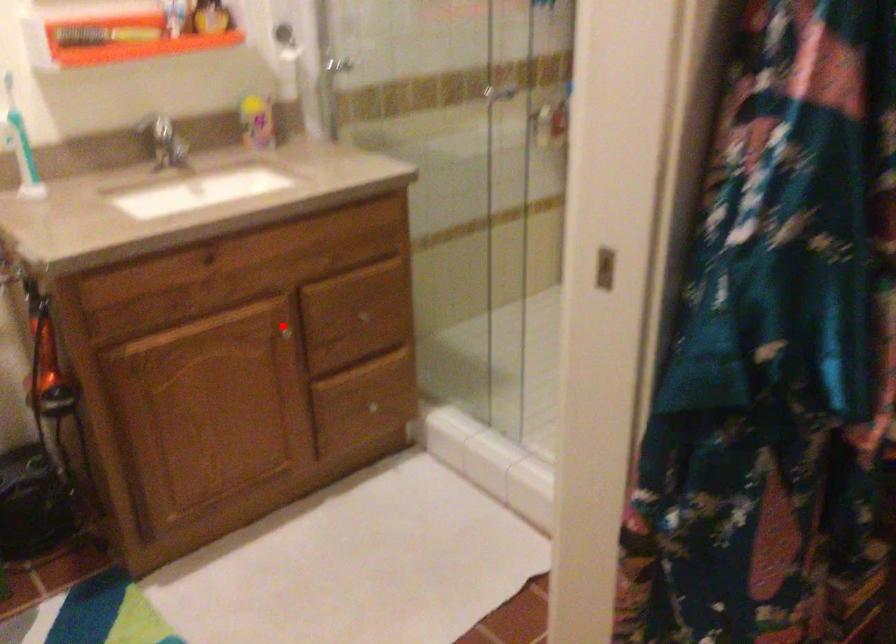
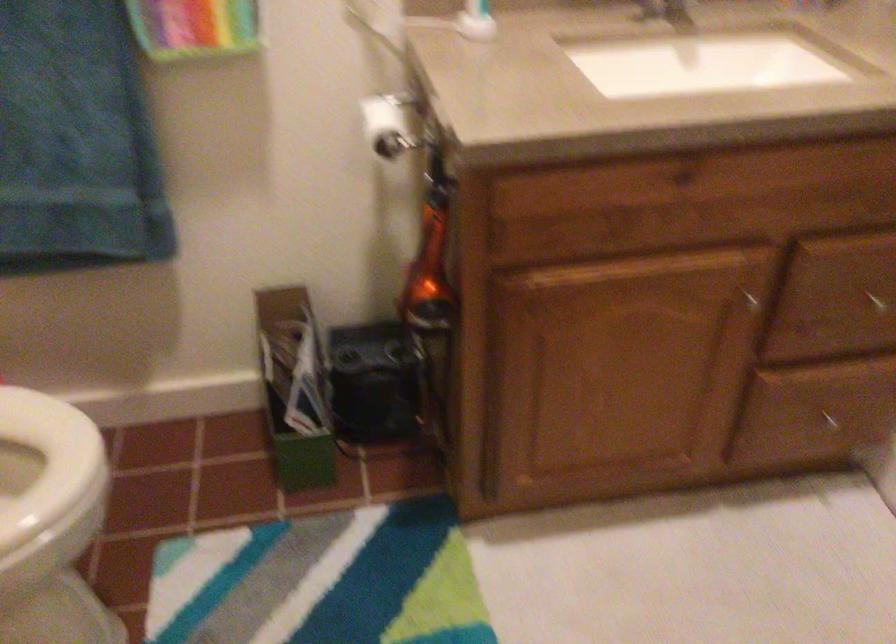
The point at the highlighted location is marked in the first image. Where is the corresponding point in the second image?

(752, 285)